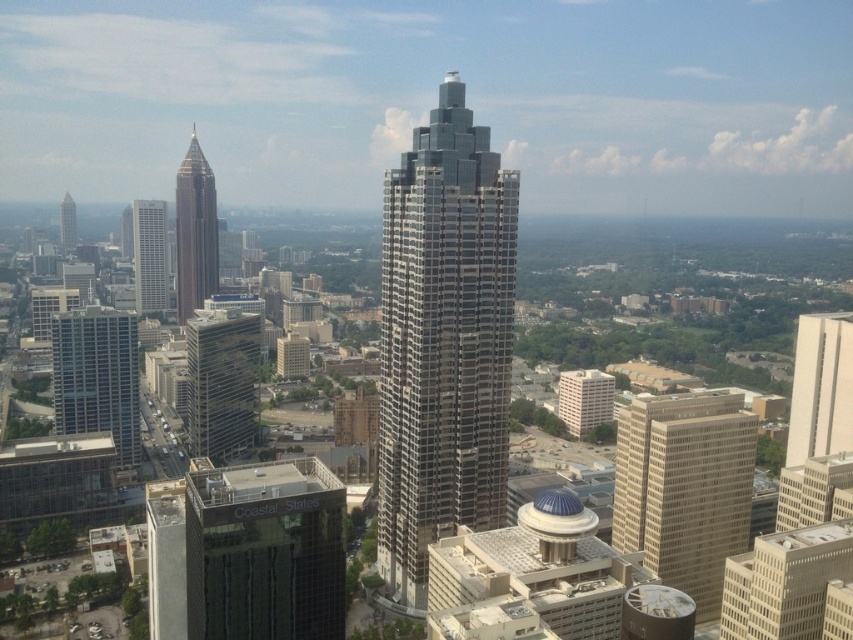
You are an architect evaluating the city skyline. You notice the dark glass building at center and the glassy reflective building at left. Which of these two buildings appears larger in the image?

The dark glass building at center appears larger than the glassy reflective building at left.